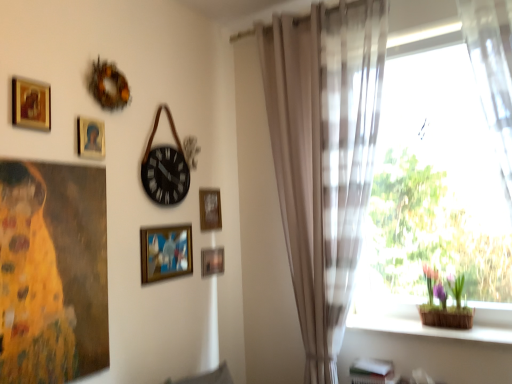
Question: Is wooden frame at center, arranged as the 3th picture frame when viewed from the left, located within metallic gold picture frame at lower center, which is the 5th picture frame in left-to-right order?

Choices:
 (A) yes
 (B) no

Answer: (B)

Question: Considering the relative sizes of metallic gold picture frame at lower center, marked as the first picture frame in a bottom-to-top arrangement, and wooden frame at center, the 2th picture frame positioned from the bottom, in the image provided, is metallic gold picture frame at lower center, marked as the first picture frame in a bottom-to-top arrangement, thinner than wooden frame at center, the 2th picture frame positioned from the bottom,?

Choices:
 (A) no
 (B) yes

Answer: (A)

Question: From the image's perspective, is metallic gold picture frame at lower center, which is the 2th picture frame in back-to-front order, over wooden frame at center, the 4th picture frame in the top-to-bottom sequence?

Choices:
 (A) yes
 (B) no

Answer: (B)

Question: Can you confirm if metallic gold picture frame at lower center, which is the 5th picture frame in left-to-right order, is positioned to the right of wooden frame at center, the 4th picture frame in the top-to-bottom sequence?

Choices:
 (A) no
 (B) yes

Answer: (B)

Question: Is metallic gold picture frame at lower center, marked as the 5th picture frame in a top-to-bottom arrangement, completely or partially outside of wooden frame at center, the 2th picture frame positioned from the bottom?

Choices:
 (A) yes
 (B) no

Answer: (A)

Question: From their relative heights in the image, would you say oil painting of woman at left is taller or shorter than wooden frame at upper center, placed as the second picture frame when sorted from right to left?

Choices:
 (A) short
 (B) tall

Answer: (B)

Question: Considering the positions of oil painting of woman at left and wooden frame at upper center, placed as the second picture frame when sorted from right to left, in the image, is oil painting of woman at left bigger or smaller than wooden frame at upper center, placed as the second picture frame when sorted from right to left,?

Choices:
 (A) small
 (B) big

Answer: (B)

Question: Does point (52, 271) appear closer or farther from the camera than point (215, 215)?

Choices:
 (A) closer
 (B) farther

Answer: (A)

Question: Would you say oil painting of woman at left is to the left or to the right of wooden frame at upper center, placed as the second picture frame when sorted from right to left, in the picture?

Choices:
 (A) left
 (B) right

Answer: (A)

Question: Is black matte clock at upper center inside or outside of oil painting of woman at left?

Choices:
 (A) outside
 (B) inside

Answer: (A)

Question: Based on their sizes in the image, would you say black matte clock at upper center is bigger or smaller than oil painting of woman at left?

Choices:
 (A) big
 (B) small

Answer: (B)

Question: Considering the positions of black matte clock at upper center and oil painting of woman at left in the image, is black matte clock at upper center taller or shorter than oil painting of woman at left?

Choices:
 (A) short
 (B) tall

Answer: (A)

Question: Does point [x=153, y=162] appear closer or farther from the camera than point [x=56, y=332]?

Choices:
 (A) closer
 (B) farther

Answer: (B)

Question: From a real-world perspective, is gold-framed portrait at upper left, the fourth picture frame in the right-to-left sequence, above or below wooden frame at upper center, placed as the second picture frame when sorted from right to left?

Choices:
 (A) below
 (B) above

Answer: (B)

Question: Considering the positions of gold-framed portrait at upper left, arranged as the fourth picture frame when viewed from the back, and wooden frame at upper center, acting as the 4th picture frame starting from the left, in the image, is gold-framed portrait at upper left, arranged as the fourth picture frame when viewed from the back, wider or thinner than wooden frame at upper center, acting as the 4th picture frame starting from the left,?

Choices:
 (A) thin
 (B) wide

Answer: (A)